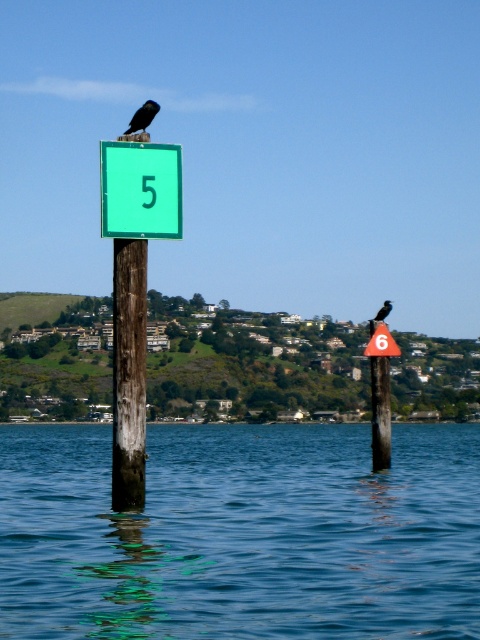
You are standing at the edge of the waterfront scene and want to determine which of the two points, point (x=113, y=262) or point (x=384, y=307), is nearer to you. Based on the image, which point is closer?

Point (x=113, y=262) is closer to the viewer than point (x=384, y=307).

You are a photographer trying to capture a shot of the weathered wood post at left and the black glossy crow at upper center. You want to ensure both are visible in your frame. Based on their positions, which object should you adjust your camera to focus on first to include both in the shot?

The weathered wood post at left is to the left of the black glossy crow at upper center, so you should focus on the black glossy crow at upper center first to ensure both are in the frame.

You are a birdwatcher observing the scene from the shore. You notice the weathered wood post at left and the green matte sign at upper center. Which object is taller in this image?

The weathered wood post at left is much taller than the green matte sign at upper center.